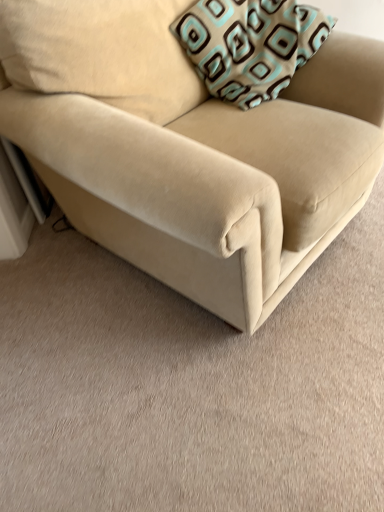
Image resolution: width=384 pixels, height=512 pixels. What are the coordinates of `free space in front of beige fabric couch at center` in the screenshot? It's located at (201, 396).